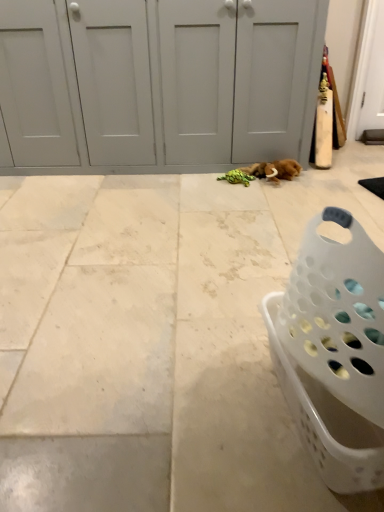
The height and width of the screenshot is (512, 384). In order to click on free space to the left of white plastic laundry basket at lower right in this screenshot , I will do `click(199, 411)`.